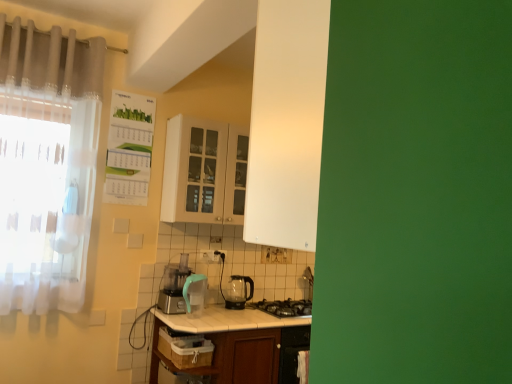
In order to face white glossy table at center, should I rotate leftwards or rightwards?

To face it directly, rotate right by 1.100 degrees.

What do you see at coordinates (51, 60) in the screenshot? This screenshot has height=384, width=512. I see `translucent fabric curtain at upper left, marked as the first curtain in a top-to-bottom arrangement` at bounding box center [51, 60].

Identify the location of matte white cabinet at center. (204, 171).

Is translucent fabric curtain at upper left, marked as the first curtain in a top-to-bottom arrangement, surrounded by white sheer curtain at left, which is the 2th curtain in top-to-bottom order?

No, translucent fabric curtain at upper left, marked as the first curtain in a top-to-bottom arrangement, is not a part of white sheer curtain at left, which is the 2th curtain in top-to-bottom order.

From their relative heights in the image, would you say white sheer curtain at left, which is the 1th curtain in bottom-to-top order, is taller or shorter than translucent fabric curtain at upper left, marked as the first curtain in a top-to-bottom arrangement?

Considering their sizes, white sheer curtain at left, which is the 1th curtain in bottom-to-top order, has more height than translucent fabric curtain at upper left, marked as the first curtain in a top-to-bottom arrangement.

Between white sheer curtain at left, which is the 1th curtain in bottom-to-top order, and translucent fabric curtain at upper left, the 2th curtain from the bottom, which one has smaller width?

Thinner between the two is white sheer curtain at left, which is the 1th curtain in bottom-to-top order.

From the picture: From a real-world perspective, is matte white cabinet at center physically located above or below transparent glass kettle at center?

matte white cabinet at center is situated higher than transparent glass kettle at center in the real world.

Considering the positions of objects matte white cabinet at center and transparent glass kettle at center in the image provided, who is more to the right, matte white cabinet at center or transparent glass kettle at center?

Positioned to the right is transparent glass kettle at center.

Are matte white cabinet at center and transparent glass kettle at center beside each other?

matte white cabinet at center and transparent glass kettle at center are clearly separated.

Can you tell me how much matte white cabinet at center and transparent glass kettle at center differ in facing direction?

0.000555 degrees separate the facing orientations of matte white cabinet at center and transparent glass kettle at center.

From the image's perspective, does white glossy table at center appear higher than white sheer curtain at left, which is the 1th curtain in bottom-to-top order?

No, from the image's perspective, white glossy table at center is not on top of white sheer curtain at left, which is the 1th curtain in bottom-to-top order.

Considering the relative positions of white glossy table at center and white sheer curtain at left, which is the 2th curtain in top-to-bottom order, in the image provided, is white glossy table at center in front of white sheer curtain at left, which is the 2th curtain in top-to-bottom order,?

No, white glossy table at center is further to the viewer.

Is white glossy table at center next to white sheer curtain at left, which is the 2th curtain in top-to-bottom order, and touching it?

white glossy table at center is not next to white sheer curtain at left, which is the 2th curtain in top-to-bottom order, and they're not touching.

Looking at this image, which of these two, black glass gas stove at lower center or white sheer curtain at left, which is the 1th curtain in bottom-to-top order, is wider?

black glass gas stove at lower center is wider.

Is black glass gas stove at lower center looking in the opposite direction of white sheer curtain at left, which is the 1th curtain in bottom-to-top order?

black glass gas stove at lower center is not turned away from white sheer curtain at left, which is the 1th curtain in bottom-to-top order.

Can you confirm if black glass gas stove at lower center is smaller than white sheer curtain at left, which is the 1th curtain in bottom-to-top order?

Yes, black glass gas stove at lower center is smaller than white sheer curtain at left, which is the 1th curtain in bottom-to-top order.

Considering the points (277, 316) and (9, 179), which point is behind, point (277, 316) or point (9, 179)?

Point (277, 316)

Is translucent fabric curtain at upper left, marked as the first curtain in a top-to-bottom arrangement, turned away from black glass gas stove at lower center?

That's not correct — translucent fabric curtain at upper left, marked as the first curtain in a top-to-bottom arrangement, is not looking away from black glass gas stove at lower center.

Who is bigger, translucent fabric curtain at upper left, marked as the first curtain in a top-to-bottom arrangement, or black glass gas stove at lower center?

With larger size is translucent fabric curtain at upper left, marked as the first curtain in a top-to-bottom arrangement.

From the image's perspective, who appears lower, translucent fabric curtain at upper left, the 2th curtain from the bottom, or black glass gas stove at lower center?

black glass gas stove at lower center, from the image's perspective.

Does point (22, 26) come behind point (305, 302)?

No, it is in front of (305, 302).

Can you confirm if white sheer curtain at left, which is the 2th curtain in top-to-bottom order, is shorter than transparent glass kettle at center?

In fact, white sheer curtain at left, which is the 2th curtain in top-to-bottom order, may be taller than transparent glass kettle at center.

Based on the photo, how different are the orientations of white sheer curtain at left, which is the 1th curtain in bottom-to-top order, and transparent glass kettle at center in degrees?

1.9 degrees.

Can you confirm if white sheer curtain at left, which is the 2th curtain in top-to-bottom order, is positioned to the right of transparent glass kettle at center?

Incorrect, white sheer curtain at left, which is the 2th curtain in top-to-bottom order, is not on the right side of transparent glass kettle at center.

I want to click on kitchen appliance to the right of white sheer curtain at left, which is the 2th curtain in top-to-bottom order, so click(x=239, y=292).

Between matte white cabinet at center and white sheer curtain at left, which is the 2th curtain in top-to-bottom order, which one has smaller size?

white sheer curtain at left, which is the 2th curtain in top-to-bottom order.

From a real-world perspective, is matte white cabinet at center positioned under white sheer curtain at left, which is the 1th curtain in bottom-to-top order, based on gravity?

No, from a real-world perspective, matte white cabinet at center is not below white sheer curtain at left, which is the 1th curtain in bottom-to-top order.

Is matte white cabinet at center thinner than white sheer curtain at left, which is the 1th curtain in bottom-to-top order?

No.

Is point (230, 202) closer or farther from the camera than point (19, 35)?

Clearly, point (230, 202) is more distant from the camera than point (19, 35).

Locate an element on the screen. Image resolution: width=512 pixels, height=384 pixels. curtain located underneath the translucent fabric curtain at upper left, the 2th curtain from the bottom (from a real-world perspective) is located at coordinates (47, 165).

In order to click on kitchen appliance to the right of matte white cabinet at center in this screenshot , I will do `click(239, 292)`.

Estimate the real-world distances between objects in this image. Which object is closer to matte white cabinet at center, black glass gas stove at lower center or black plastic electric outlet at center?

The object closer to matte white cabinet at center is black plastic electric outlet at center.

When comparing their distances from black glass gas stove at lower center, does translucent fabric curtain at upper left, marked as the first curtain in a top-to-bottom arrangement, or teal plastic pitcher at center seem further?

translucent fabric curtain at upper left, marked as the first curtain in a top-to-bottom arrangement, is positioned further to the anchor black glass gas stove at lower center.

Estimate the real-world distances between objects in this image. Which object is closer to matte white cabinet at center, translucent fabric curtain at upper left, marked as the first curtain in a top-to-bottom arrangement, or white glossy table at center?

translucent fabric curtain at upper left, marked as the first curtain in a top-to-bottom arrangement, lies closer to matte white cabinet at center than the other object.

From the image, which object appears to be farther from white sheer curtain at left, which is the 1th curtain in bottom-to-top order, translucent fabric curtain at upper left, marked as the first curtain in a top-to-bottom arrangement, or transparent glass kettle at center?

The object further to white sheer curtain at left, which is the 1th curtain in bottom-to-top order, is transparent glass kettle at center.

Looking at the image, which one is located further to white sheer curtain at left, which is the 2th curtain in top-to-bottom order, black glass gas stove at lower center or black plastic electric outlet at center?

black glass gas stove at lower center is further to white sheer curtain at left, which is the 2th curtain in top-to-bottom order.

Consider the image. When comparing their distances from white sheer curtain at left, which is the 2th curtain in top-to-bottom order, does teal plastic pitcher at center or translucent fabric curtain at upper left, the 2th curtain from the bottom, seem closer?

Based on the image, translucent fabric curtain at upper left, the 2th curtain from the bottom, appears to be nearer to white sheer curtain at left, which is the 2th curtain in top-to-bottom order.

From the image, which object appears to be nearer to translucent fabric curtain at upper left, the 2th curtain from the bottom, black plastic electric outlet at center or teal plastic pitcher at center?

teal plastic pitcher at center lies closer to translucent fabric curtain at upper left, the 2th curtain from the bottom, than the other object.

Based on their spatial positions, is white sheer curtain at left, which is the 2th curtain in top-to-bottom order, or white glossy table at center further from transparent glass kettle at center?

Among the two, white sheer curtain at left, which is the 2th curtain in top-to-bottom order, is located further to transparent glass kettle at center.

Image resolution: width=512 pixels, height=384 pixels. Find the location of `electric outlet between white sheer curtain at left, which is the 1th curtain in bottom-to-top order, and black glass gas stove at lower center`. electric outlet between white sheer curtain at left, which is the 1th curtain in bottom-to-top order, and black glass gas stove at lower center is located at coordinates (220, 255).

This screenshot has height=384, width=512. I want to click on kitchen appliance between white sheer curtain at left, which is the 2th curtain in top-to-bottom order, and black glass gas stove at lower center from left to right, so click(239, 292).

Locate an element on the screen. The height and width of the screenshot is (384, 512). appliance between white sheer curtain at left, which is the 1th curtain in bottom-to-top order, and black glass gas stove at lower center from left to right is located at coordinates (195, 294).

Identify the location of cabinetry between white sheer curtain at left, which is the 2th curtain in top-to-bottom order, and transparent glass kettle at center from left to right. The image size is (512, 384). (204, 171).